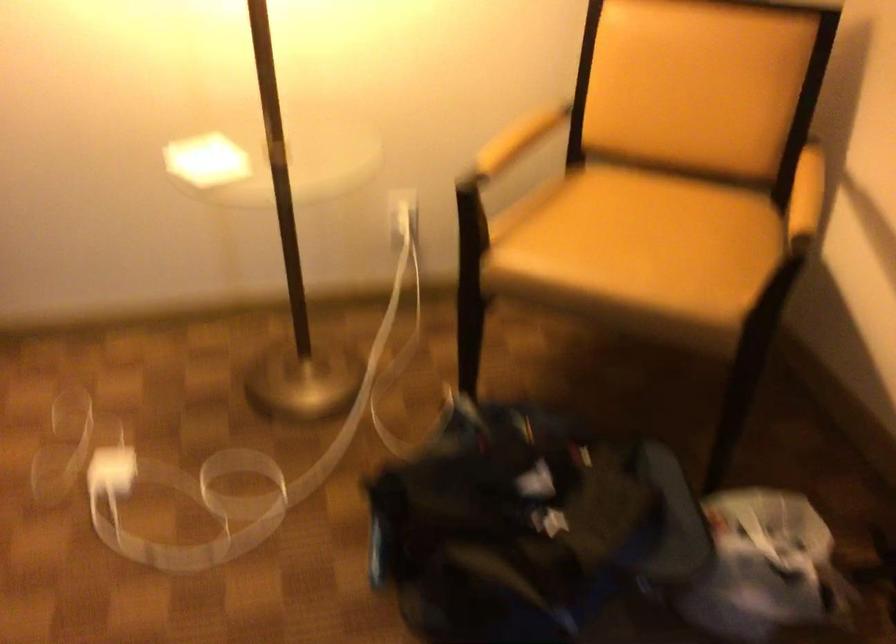
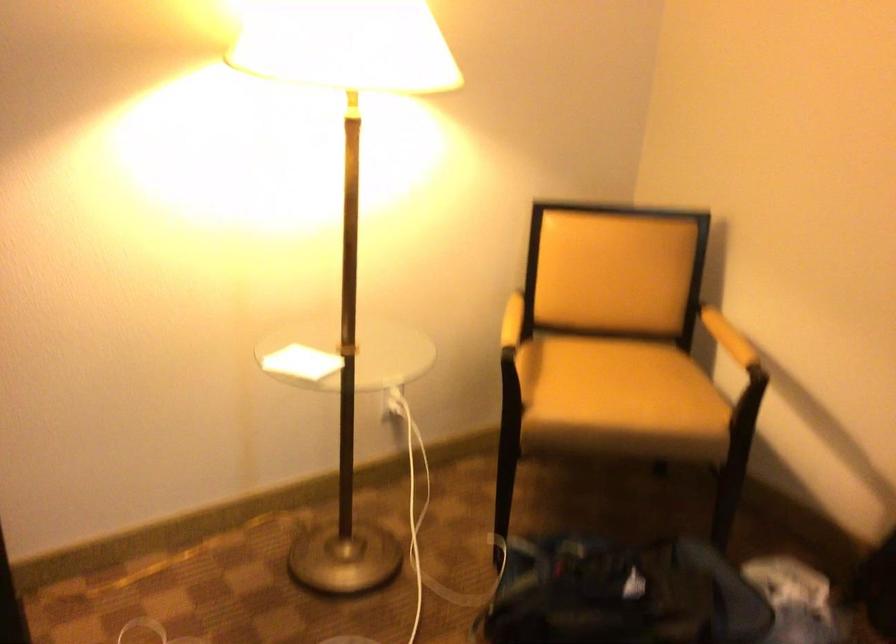
The point at (798,193) is marked in the first image. Where is the corresponding point in the second image?

(728, 337)